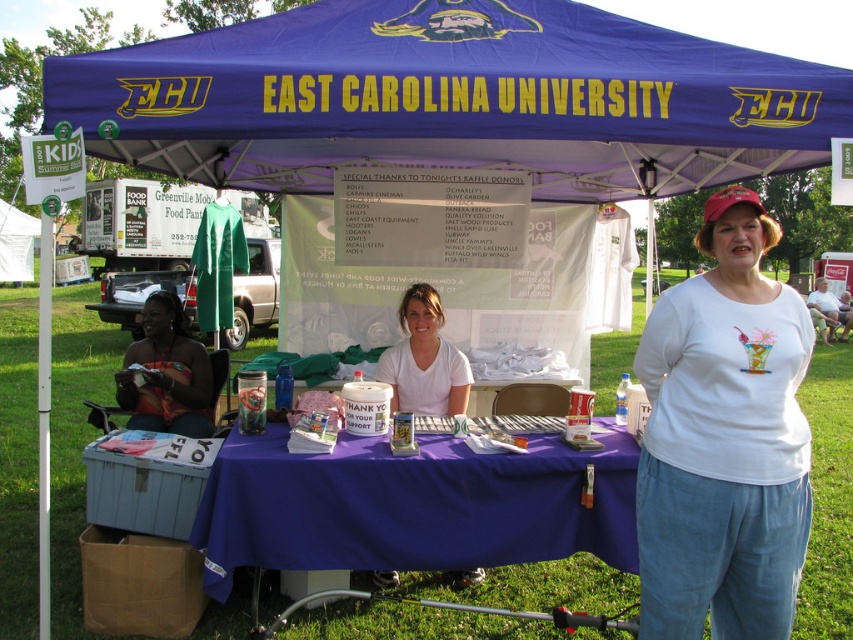
You are a photographer at the East Carolina University event. You need to adjust the lighting so that both the purple fabric table at center and the white matte shirt at center are well lit. Based on their positions, which object is closer to the camera and should be prioritized for lighting adjustments?

The white matte shirt at center is closer to the camera than the purple fabric table at center, so prioritize lighting adjustments for the white matte shirt at center to ensure proper exposure.

You are attending an event at East Carolina University and see the purple fabric table at center and the white matte shirt at center. From the perspective of someone standing at the back of the canopy, which object is positioned to the right?

The purple fabric table at center is to the right of the white matte shirt at center from the perspective of someone standing at the back of the canopy.